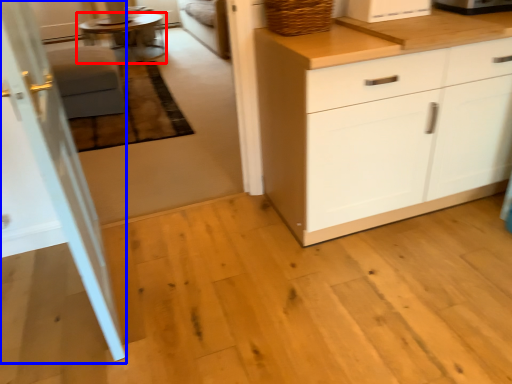
Question: Which of the following is the closest to the observer, table (highlighted by a red box) or screen door (highlighted by a blue box)?

Choices:
 (A) table
 (B) screen door

Answer: (B)